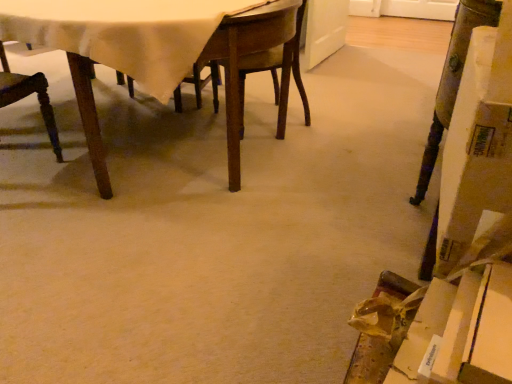
Question: Is wooden table at center inside the boundaries of wooden chair at left, or outside?

Choices:
 (A) outside
 (B) inside

Answer: (A)

Question: Would you say wooden table at center is to the left or to the right of wooden chair at left in the picture?

Choices:
 (A) left
 (B) right

Answer: (B)

Question: From a real-world perspective, is wooden table at center above or below wooden chair at left?

Choices:
 (A) above
 (B) below

Answer: (A)

Question: In terms of width, does wooden chair at left look wider or thinner when compared to wooden table at center?

Choices:
 (A) thin
 (B) wide

Answer: (A)

Question: From a real-world perspective, is wooden chair at left above or below wooden table at center?

Choices:
 (A) below
 (B) above

Answer: (A)

Question: From the image's perspective, relative to wooden table at center, is wooden chair at left above or below?

Choices:
 (A) below
 (B) above

Answer: (A)

Question: Considering the positions of wooden chair at left and wooden table at center in the image, is wooden chair at left taller or shorter than wooden table at center?

Choices:
 (A) short
 (B) tall

Answer: (B)